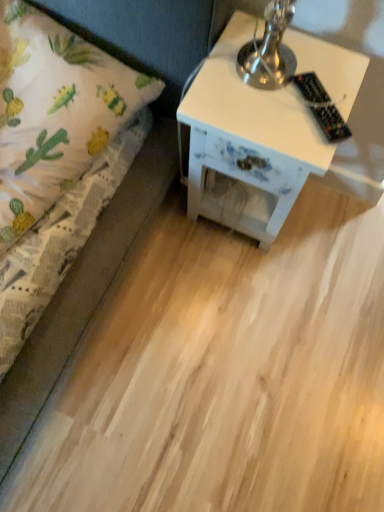
Find the location of `white painted wood nightstand at right`. white painted wood nightstand at right is located at coordinates (247, 143).

Measure the distance between black plastic remote control at upper right and camera.

The depth of black plastic remote control at upper right is 78.33 centimeters.

Image resolution: width=384 pixels, height=512 pixels. Identify the location of black plastic remote control at upper right. click(322, 106).

Describe the element at coordinates (62, 156) in the screenshot. This screenshot has height=512, width=384. I see `white fabric bed at left` at that location.

The image size is (384, 512). I want to click on white painted wood nightstand at right, so click(247, 143).

From the image's perspective, is black plastic remote control at upper right above or below white fabric bed at left?

Clearly, from the image's perspective, black plastic remote control at upper right is above white fabric bed at left.

Considering the sizes of objects black plastic remote control at upper right and white fabric bed at left in the image provided, who is bigger, black plastic remote control at upper right or white fabric bed at left?

white fabric bed at left is bigger.

Is black plastic remote control at upper right far away from white fabric bed at left?

black plastic remote control at upper right is near white fabric bed at left, not far away.

Is white fabric bed at left far from black plastic remote control at upper right?

white fabric bed at left is actually quite close to black plastic remote control at upper right.

Considering the relative sizes of white fabric bed at left and black plastic remote control at upper right in the image provided, is white fabric bed at left shorter than black plastic remote control at upper right?

Incorrect, the height of white fabric bed at left does not fall short of that of black plastic remote control at upper right.

How many degrees apart are the facing directions of white fabric bed at left and black plastic remote control at upper right?

They differ by 45.6 degrees in their facing directions.

Is black plastic remote control at upper right at the back of white fabric bed at left?

No, white fabric bed at left is not facing away from black plastic remote control at upper right.

Is white fabric bed at left oriented away from white painted wood nightstand at right?

No, white painted wood nightstand at right is not at the back of white fabric bed at left.

Is white fabric bed at left outside of white painted wood nightstand at right?

Yes, white fabric bed at left is located beyond the bounds of white painted wood nightstand at right.

Is there a large distance between white fabric bed at left and white painted wood nightstand at right?

They are positioned close to each other.

Which object is further away from the camera, white fabric bed at left or white painted wood nightstand at right?

white painted wood nightstand at right.

How different are the orientations of white painted wood nightstand at right and white fabric bed at left in degrees?

The angular difference between white painted wood nightstand at right and white fabric bed at left is 4.2 degrees.

Image resolution: width=384 pixels, height=512 pixels. I want to click on bed located in front of the white painted wood nightstand at right, so click(62, 156).

Does white painted wood nightstand at right have a lesser height compared to white fabric bed at left?

In fact, white painted wood nightstand at right may be taller than white fabric bed at left.

Is white painted wood nightstand at right facing towards white fabric bed at left?

No, white painted wood nightstand at right is not turned towards white fabric bed at left.

Is black plastic remote control at upper right taller than white painted wood nightstand at right?

No, black plastic remote control at upper right is not taller than white painted wood nightstand at right.

Based on the photo, is black plastic remote control at upper right positioned before white painted wood nightstand at right?

That is True.

Is black plastic remote control at upper right completely or partially outside of white painted wood nightstand at right?

That's correct, black plastic remote control at upper right is outside of white painted wood nightstand at right.

Is black plastic remote control at upper right next to white painted wood nightstand at right and touching it?

No, black plastic remote control at upper right is not in contact with white painted wood nightstand at right.

What's the angular difference between white painted wood nightstand at right and black plastic remote control at upper right's facing directions?

There is a 49.8-degree angle between the facing directions of white painted wood nightstand at right and black plastic remote control at upper right.

Is white painted wood nightstand at right thinner than black plastic remote control at upper right?

No, white painted wood nightstand at right is not thinner than black plastic remote control at upper right.

Does white painted wood nightstand at right have a lesser height compared to black plastic remote control at upper right?

No.

How distant is white painted wood nightstand at right from black plastic remote control at upper right?

A distance of 6.76 inches exists between white painted wood nightstand at right and black plastic remote control at upper right.

Find the location of a particular element. remote control on the right of white fabric bed at left is located at coordinates (322, 106).

What are the coordinates of `remote control above the white fabric bed at left (from the image's perspective)` in the screenshot? It's located at (322, 106).

Looking at the image, which one is located further to white painted wood nightstand at right, white fabric bed at left or black plastic remote control at upper right?

The object further to white painted wood nightstand at right is white fabric bed at left.

Looking at the image, which one is located closer to white fabric bed at left, white painted wood nightstand at right or black plastic remote control at upper right?

white painted wood nightstand at right lies closer to white fabric bed at left than the other object.

From the image, which object appears to be farther from white fabric bed at left, black plastic remote control at upper right or white painted wood nightstand at right?

Based on the image, black plastic remote control at upper right appears to be further to white fabric bed at left.

Looking at the image, which one is located closer to black plastic remote control at upper right, white fabric bed at left or white painted wood nightstand at right?

Among the two, white painted wood nightstand at right is located nearer to black plastic remote control at upper right.

Based on their spatial positions, is black plastic remote control at upper right or white fabric bed at left closer to white painted wood nightstand at right?

Among the two, black plastic remote control at upper right is located nearer to white painted wood nightstand at right.

Looking at the image, which one is located further to black plastic remote control at upper right, white painted wood nightstand at right or white fabric bed at left?

The object further to black plastic remote control at upper right is white fabric bed at left.

The height and width of the screenshot is (512, 384). I want to click on nightstand between white fabric bed at left and black plastic remote control at upper right, so click(247, 143).